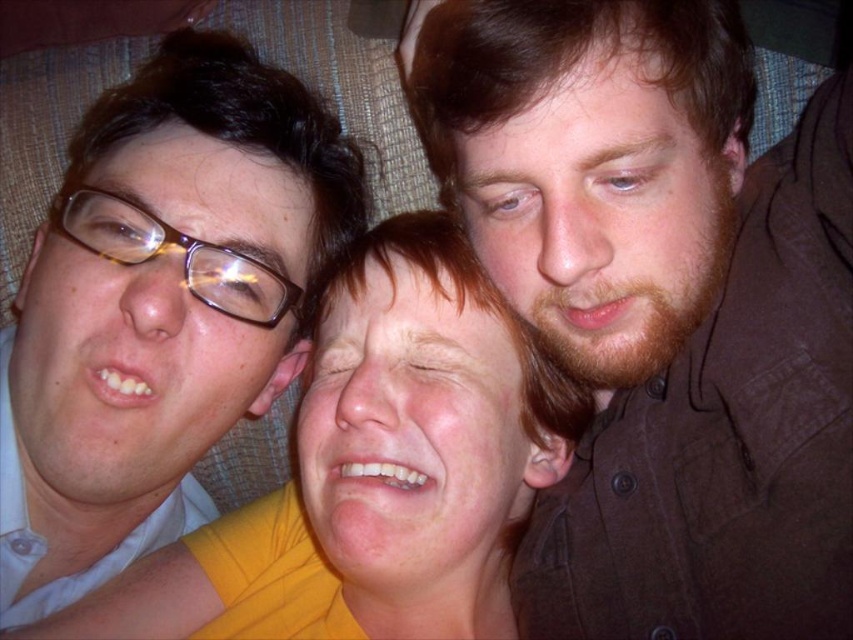
You are a photographer trying to capture a candid shot of the three people in the scene. You notice the brown matte shirt at upper right and the matte black glasses at left. Which object should you focus on first if you want to capture the tallest object in the frame?

The brown matte shirt at upper right is taller than the matte black glasses at left, so you should focus on the brown matte shirt at upper right first to capture the tallest object in the frame.

You are a photographer trying to capture a closeup shot of the matte black glasses at left and the yellow matte shirt at center. Which object should you zoom in on to ensure both are in focus without adjusting your camera settings?

The matte black glasses at left is larger in size compared to the yellow matte shirt at center, so you should zoom in on the matte black glasses at left to ensure both objects are in focus.

You are a photographer trying to fit all three people into a group photo. The camera frame can only accommodate the width of the yellow matte shirt at center. Will the brown matte shirt at upper right also fit within the frame?

The brown matte shirt at upper right has a lesser width compared to yellow matte shirt at center, so it will fit within the frame since it is narrower than the yellow matte shirt at center which the frame can accommodate.